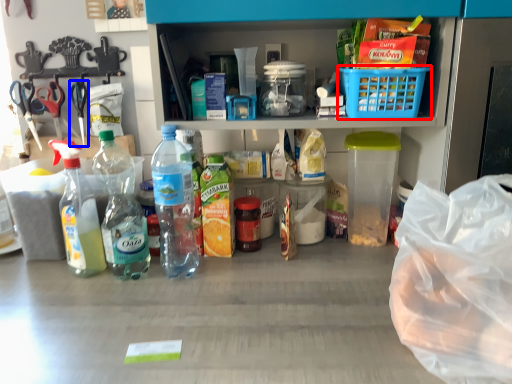
Question: Which of the following is the farthest to the observer, basket (highlighted by a red box) or scissors (highlighted by a blue box)?

Choices:
 (A) basket
 (B) scissors

Answer: (B)